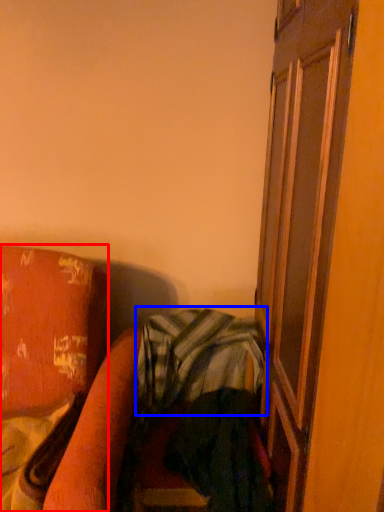
Question: Which of the following is the closest to the observer, furniture (highlighted by a red box) or plaid (highlighted by a blue box)?

Choices:
 (A) furniture
 (B) plaid

Answer: (A)